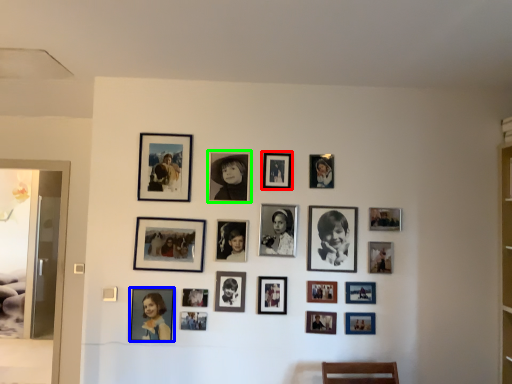
Question: Which is farther away from picture frame (highlighted by a red box)? picture frame (highlighted by a blue box) or picture frame (highlighted by a green box)?

Choices:
 (A) picture frame
 (B) picture frame

Answer: (A)